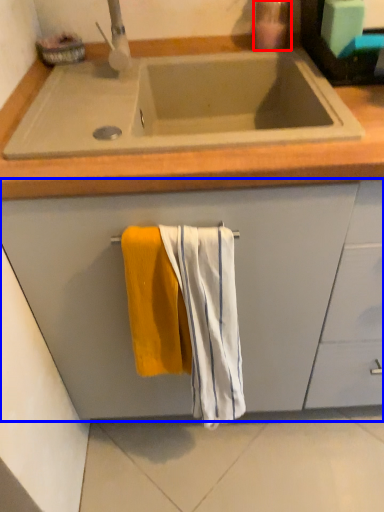
Question: Which point is closer to the camera, soap dispenser (highlighted by a red box) or cabinetry (highlighted by a blue box)?

Choices:
 (A) soap dispenser
 (B) cabinetry

Answer: (B)